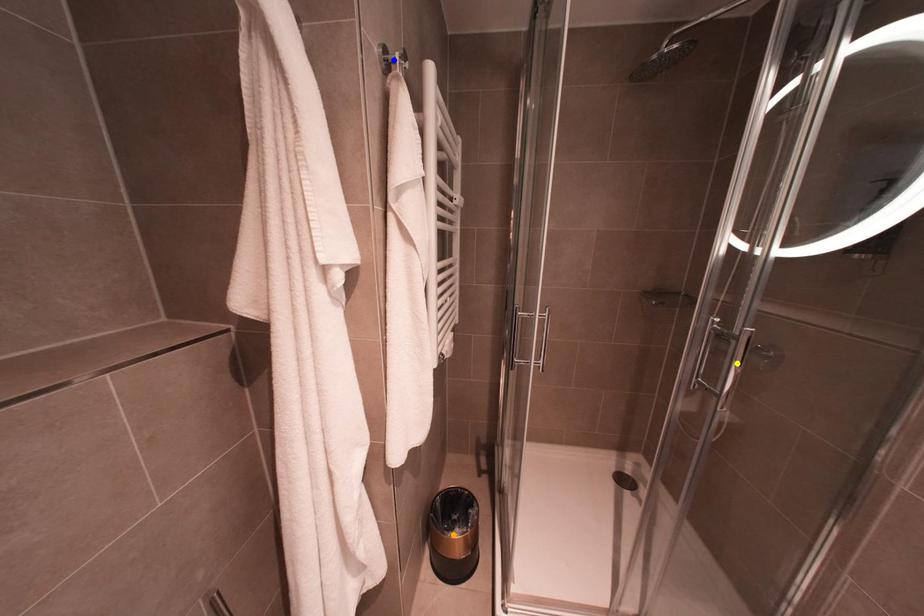
Order these from farthest to nearest:
A) blue point
B) orange point
C) yellow point

orange point → yellow point → blue point